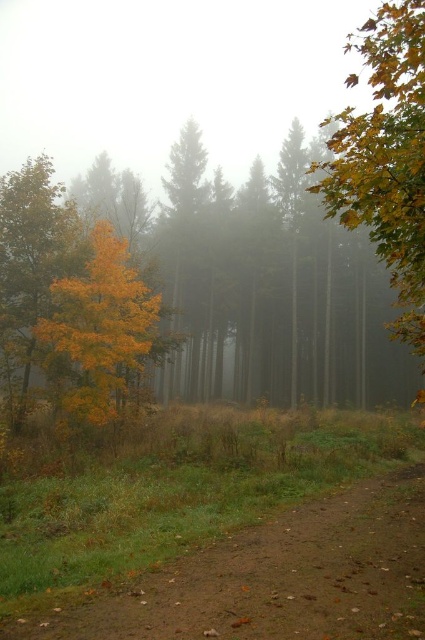
You are a hiker trying to find your way through the forest. You see the brown dirt path at lower right and the golden maple leaf at right. Which object is located to the left of the other?

The brown dirt path at lower right is positioned on the left side of golden maple leaf at right, so the dirt path is to the left of the maple leaf.

You are a hiker trying to follow the dirt path in the forest. You notice the golden yellow leaves at center and the brown dirt path at lower right. Which of these two features is closer to you as you stand on the path?

The brown dirt path at lower right is closer to the viewer than the golden yellow leaves at center, so the dirt path is nearer to you.